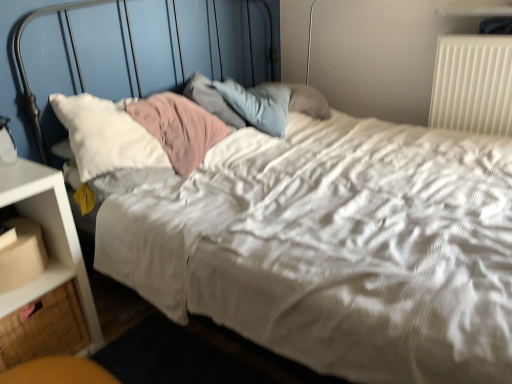
Question: Can you confirm if beige fabric drawer at lower left is taller than white plastic radiator at upper right?

Choices:
 (A) yes
 (B) no

Answer: (B)

Question: Can we say beige fabric drawer at lower left lies outside white plastic radiator at upper right?

Choices:
 (A) yes
 (B) no

Answer: (A)

Question: Does beige fabric drawer at lower left lie in front of white plastic radiator at upper right?

Choices:
 (A) no
 (B) yes

Answer: (B)

Question: Can you confirm if beige fabric drawer at lower left is thinner than white plastic radiator at upper right?

Choices:
 (A) yes
 (B) no

Answer: (B)

Question: Is beige fabric drawer at lower left oriented towards white plastic radiator at upper right?

Choices:
 (A) yes
 (B) no

Answer: (B)

Question: Which is correct: matte cardboard box at lower left is inside beige fabric drawer at lower left, or outside of it?

Choices:
 (A) inside
 (B) outside

Answer: (B)

Question: In the image, is matte cardboard box at lower left on the left side or the right side of beige fabric drawer at lower left?

Choices:
 (A) left
 (B) right

Answer: (B)

Question: From the image's perspective, is matte cardboard box at lower left above or below beige fabric drawer at lower left?

Choices:
 (A) above
 (B) below

Answer: (A)

Question: In terms of height, does matte cardboard box at lower left look taller or shorter compared to beige fabric drawer at lower left?

Choices:
 (A) tall
 (B) short

Answer: (B)

Question: From their relative heights in the image, would you say white plastic nightstand at lower left is taller or shorter than matte cardboard box at lower left?

Choices:
 (A) short
 (B) tall

Answer: (B)

Question: Is white plastic nightstand at lower left to the left or to the right of matte cardboard box at lower left in the image?

Choices:
 (A) right
 (B) left

Answer: (B)

Question: Does point (41, 279) appear closer or farther from the camera than point (53, 248)?

Choices:
 (A) closer
 (B) farther

Answer: (A)

Question: From a real-world perspective, is white plastic nightstand at lower left positioned above or below matte cardboard box at lower left?

Choices:
 (A) below
 (B) above

Answer: (A)

Question: In the image, is white plastic radiator at upper right positioned in front of or behind beige fabric drawer at lower left?

Choices:
 (A) front
 (B) behind

Answer: (B)

Question: From a real-world perspective, is white plastic radiator at upper right physically located above or below beige fabric drawer at lower left?

Choices:
 (A) below
 (B) above

Answer: (B)